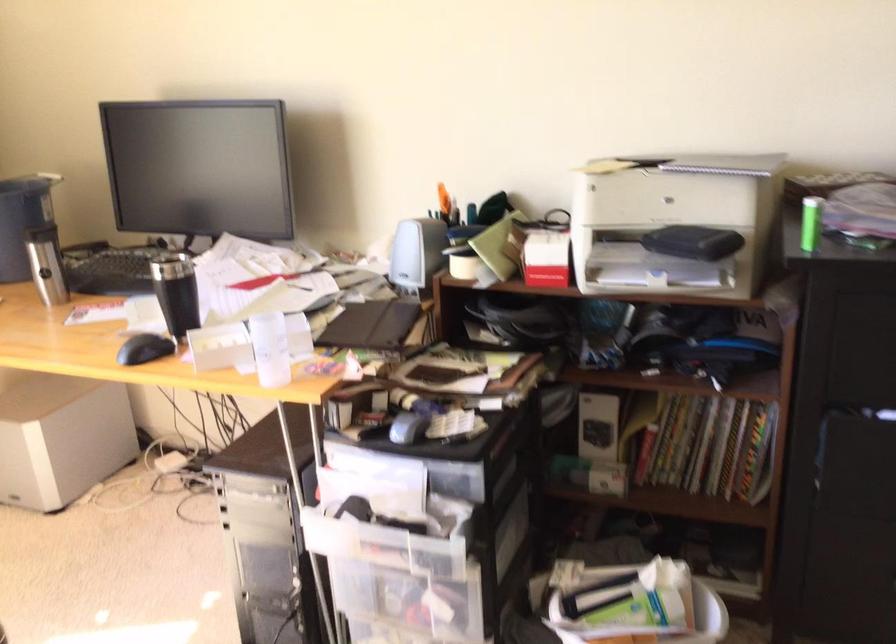
You are a GUI agent. You are given a task and a screenshot of the screen. Output one action in this format:
    pyautogui.click(x=<x>, y=<y>)
    Task: Click on the black travel mug
    
    Given the screenshot: What is the action you would take?
    pyautogui.click(x=176, y=292)